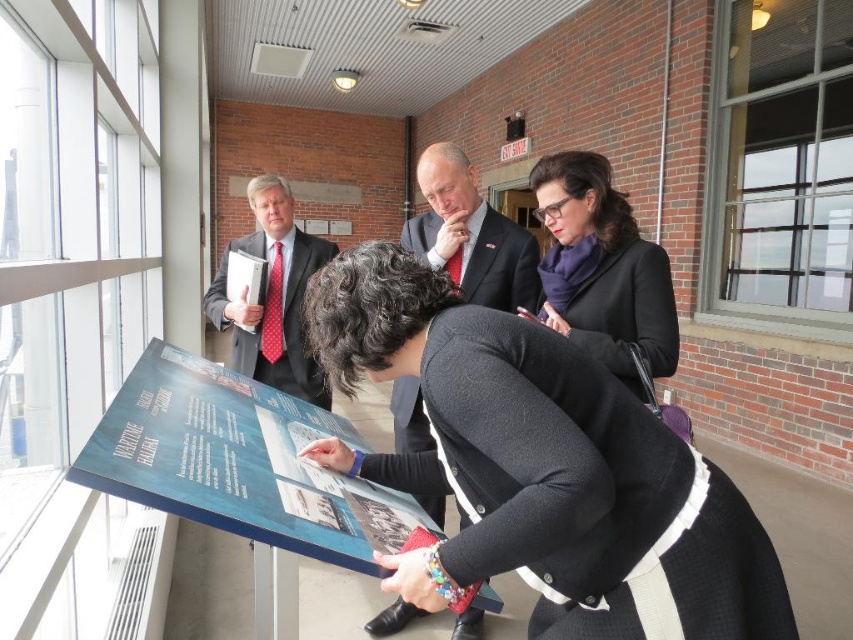
Question: Does blue glossy poster at lower left appear over purple scarf at upper right?

Choices:
 (A) yes
 (B) no

Answer: (B)

Question: Is black wool coat at center smaller than matte black suit at left?

Choices:
 (A) yes
 (B) no

Answer: (B)

Question: Which object is positioned closest to the black wool coat at center?

Choices:
 (A) matte black suit at left
 (B) matte black suit at center
 (C) blue glossy poster at lower left

Answer: (C)

Question: Which point appears closest to the camera in this image?

Choices:
 (A) (466, 189)
 (B) (120, 449)

Answer: (B)

Question: Can you confirm if black wool coat at center is bigger than matte black suit at left?

Choices:
 (A) no
 (B) yes

Answer: (B)

Question: Estimate the real-world distances between objects in this image. Which object is farther from the matte black suit at center?

Choices:
 (A) matte black suit at left
 (B) purple scarf at upper right
 (C) blue glossy poster at lower left
 (D) black wool coat at center

Answer: (A)